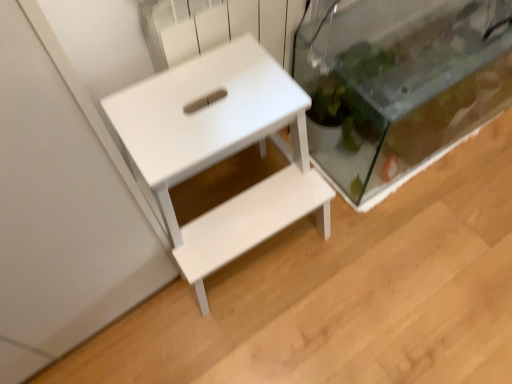
Question: Is point (309, 107) positioned closer to the camera than point (421, 3)?

Choices:
 (A) closer
 (B) farther

Answer: (A)

Question: Do you think white matte table at center is within transparent glass tank at right, or outside of it?

Choices:
 (A) outside
 (B) inside

Answer: (A)

Question: In the image, is white matte table at center positioned in front of or behind transparent glass tank at right?

Choices:
 (A) behind
 (B) front

Answer: (B)

Question: Is transparent glass tank at right taller or shorter than white matte table at center?

Choices:
 (A) short
 (B) tall

Answer: (A)

Question: Considering the relative positions of transparent glass tank at right and white matte table at center in the image provided, is transparent glass tank at right to the left or to the right of white matte table at center?

Choices:
 (A) right
 (B) left

Answer: (A)

Question: From a real-world perspective, relative to white matte table at center, is transparent glass tank at right vertically above or below?

Choices:
 (A) below
 (B) above

Answer: (A)

Question: Choose the correct answer: Is transparent glass tank at right inside white matte table at center or outside it?

Choices:
 (A) outside
 (B) inside

Answer: (A)